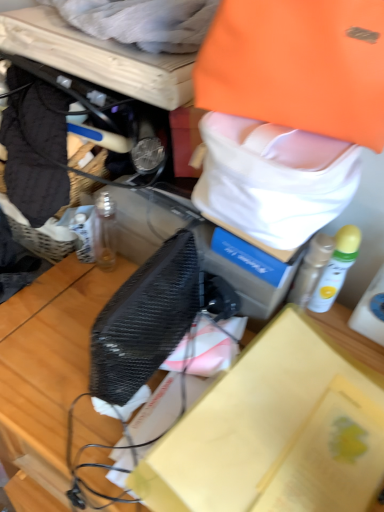
You are a GUI agent. You are given a task and a screenshot of the screen. Output one action in this format:
    pyautogui.click(x=<x>, y=<y>)
    Task: Click on the vacant area located to the right-hand side of white matte bottle at upper right, the second bottle when ordered from right to left
    The width and height of the screenshot is (384, 512).
    Given the screenshot: What is the action you would take?
    pyautogui.click(x=347, y=331)